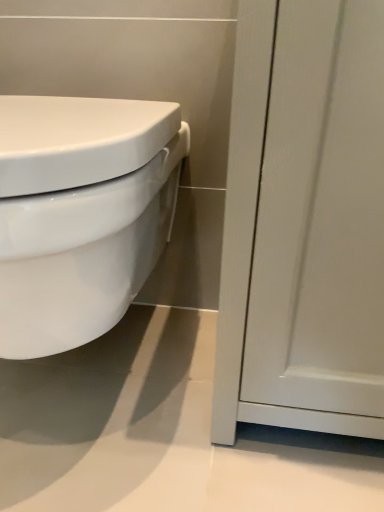
Question: Is matte white cabinet at right taller or shorter than white glossy toilet at left?

Choices:
 (A) short
 (B) tall

Answer: (B)

Question: Which is correct: matte white cabinet at right is inside white glossy toilet at left, or outside of it?

Choices:
 (A) outside
 (B) inside

Answer: (A)

Question: From the image's perspective, is matte white cabinet at right above or below white glossy toilet at left?

Choices:
 (A) below
 (B) above

Answer: (B)

Question: Is white glossy toilet at left spatially inside matte white cabinet at right, or outside of it?

Choices:
 (A) outside
 (B) inside

Answer: (A)

Question: Based on their sizes in the image, would you say white glossy toilet at left is bigger or smaller than matte white cabinet at right?

Choices:
 (A) big
 (B) small

Answer: (A)

Question: Would you say white glossy toilet at left is to the left or to the right of matte white cabinet at right in the picture?

Choices:
 (A) left
 (B) right

Answer: (A)

Question: From the image's perspective, is white glossy toilet at left above or below matte white cabinet at right?

Choices:
 (A) above
 (B) below

Answer: (B)